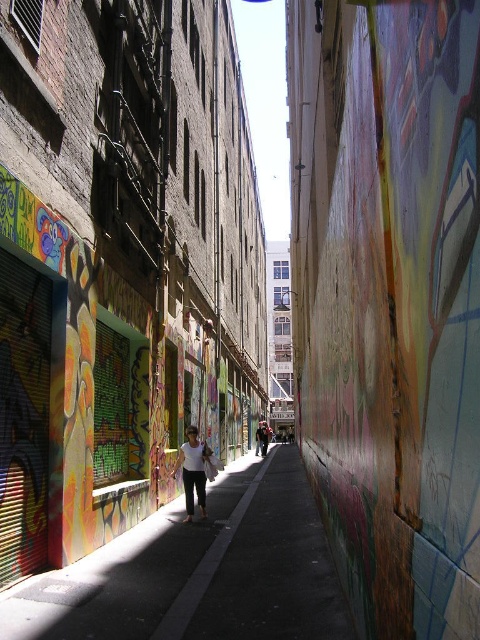
Question: Which point is closer to the camera?

Choices:
 (A) dark asphalt pavement at center
 (B) white matte tank top at center

Answer: (A)

Question: From the image, what is the correct spatial relationship of dark asphalt pavement at center in relation to white matte tank top at center?

Choices:
 (A) above
 (B) below

Answer: (B)

Question: Which of the following is the closest to the observer?

Choices:
 (A) (111, 557)
 (B) (188, 451)

Answer: (A)

Question: Which point is farther to the camera?

Choices:
 (A) dark asphalt pavement at center
 (B) white matte tank top at center

Answer: (B)

Question: Is dark asphalt pavement at center closer to the viewer compared to white matte tank top at center?

Choices:
 (A) no
 (B) yes

Answer: (B)

Question: Does dark asphalt pavement at center appear on the left side of white matte tank top at center?

Choices:
 (A) yes
 (B) no

Answer: (B)